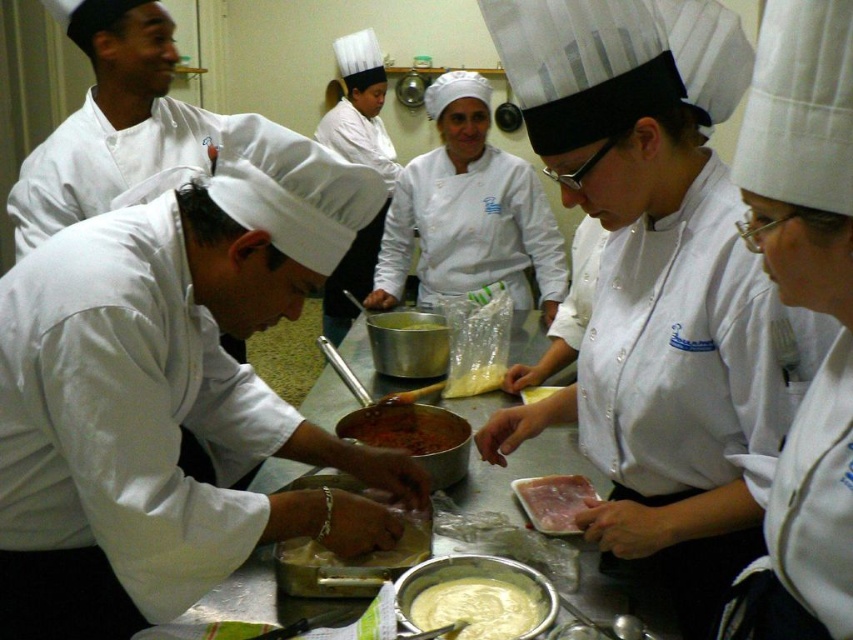
You are a new chef entering the kitchen and need to reach the white creamy sauce at center without touching the white matte chef coat at left. Is this possible given their positions?

The white matte chef coat at left is on the left side of the white creamy sauce at center, so you can reach the white creamy sauce at center by moving around to the right side of the coat to avoid contact.

You are a food safety inspector in the kitchen. You notice the white glossy chef coat at center and the white creamy sauce at center. According to food safety guidelines, should you be concerned about the coat being above the sauce?

Yes, the white glossy chef coat at center is positioned over the white creamy sauce at center, which violates food safety guidelines as the coat could contaminate the sauce through dripping or falling particles.

You are a new chef entering the kitchen and need to locate the white matte chef coat at left and the white creamy dough at center. Based on the scene, which object is taller?

The white matte chef coat at left is taller than the white creamy dough at center.